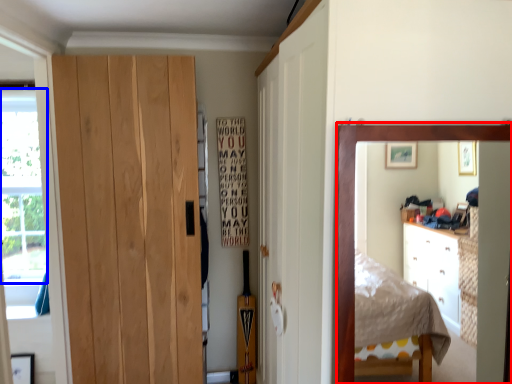
Question: Which of the following is the farthest to the observer, mirror (highlighted by a red box) or window screen (highlighted by a blue box)?

Choices:
 (A) mirror
 (B) window screen

Answer: (B)